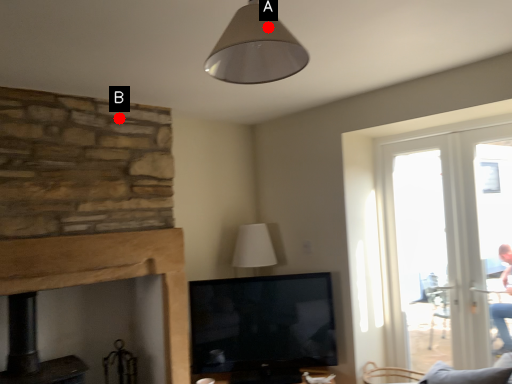
Question: Two points are circled on the image, labeled by A and B beside each circle. Which point is closer to the camera?

Choices:
 (A) A is closer
 (B) B is closer

Answer: (A)